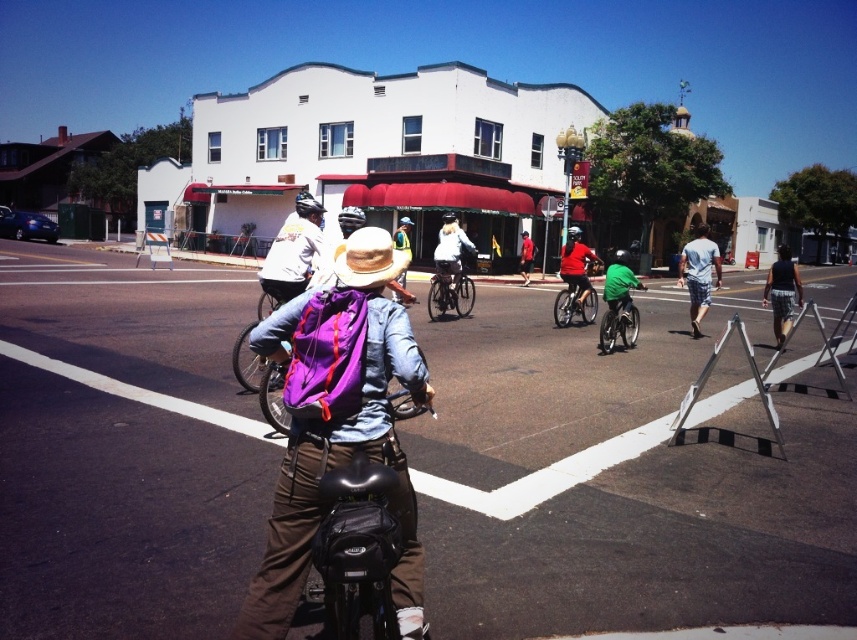
Can you confirm if purple fabric backpack at center is taller than gray cotton shirt at right?

In fact, purple fabric backpack at center may be shorter than gray cotton shirt at right.

Does purple fabric backpack at center have a larger size compared to gray cotton shirt at right?

No.

This screenshot has width=857, height=640. Describe the element at coordinates (339, 424) in the screenshot. I see `purple fabric backpack at center` at that location.

You are a GUI agent. You are given a task and a screenshot of the screen. Output one action in this format:
    pyautogui.click(x=<x>, y=<y>)
    Task: Click on the purple fabric backpack at center
    This screenshot has height=640, width=857.
    Given the screenshot: What is the action you would take?
    [x=339, y=424]

Can you confirm if white matte jacket at center is thinner than shiny silver bicycle at center?

In fact, white matte jacket at center might be wider than shiny silver bicycle at center.

Measure the distance between white matte jacket at center and shiny silver bicycle at center.

A distance of 4.63 meters exists between white matte jacket at center and shiny silver bicycle at center.

Is point (304, 220) positioned behind point (452, 269)?

No, (304, 220) is in front of (452, 269).

The height and width of the screenshot is (640, 857). Find the location of `white matte jacket at center`. white matte jacket at center is located at coordinates pos(292,250).

Is strawmaterial/texturehat at center above reflective yellow vest at center?

Actually, strawmaterial/texturehat at center is below reflective yellow vest at center.

Looking at this image, is strawmaterial/texturehat at center closer to the viewer compared to reflective yellow vest at center?

Yes, strawmaterial/texturehat at center is closer to the viewer.

Locate an element on the screen. The image size is (857, 640). strawmaterial/texturehat at center is located at coordinates (369, 259).

The width and height of the screenshot is (857, 640). I want to click on strawmaterial/texturehat at center, so click(x=369, y=259).